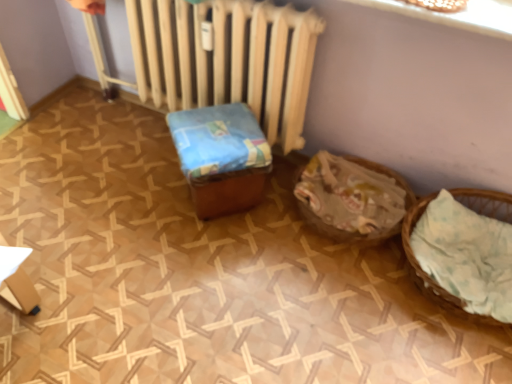
This screenshot has height=384, width=512. I want to click on vacant space positioned to the left of white matte radiator at center, so click(77, 144).